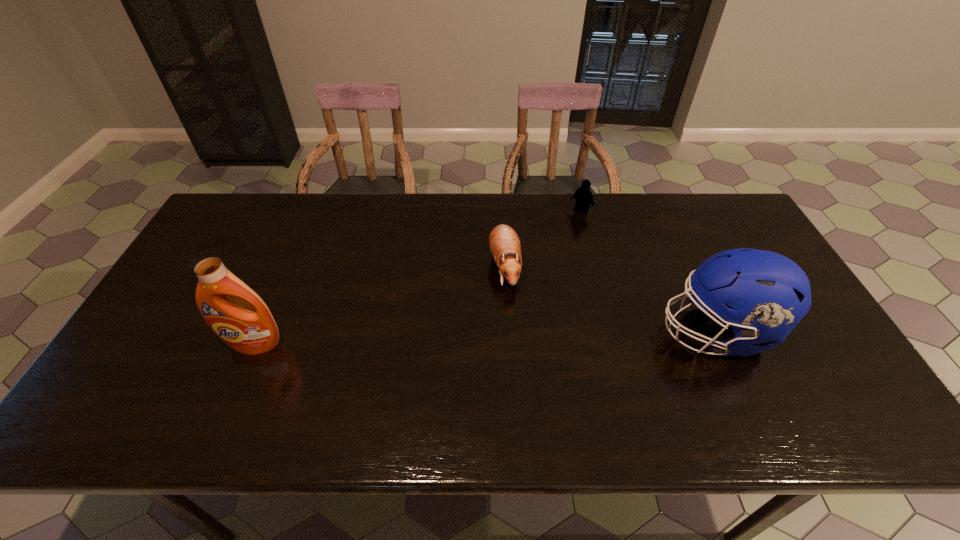
What are the coordinates of `the leftmost object` in the screenshot? It's located at (235, 313).

In order to click on the third shortest object in this screenshot , I will do (768, 293).

Where is `football helmet`? Image resolution: width=960 pixels, height=540 pixels. football helmet is located at coordinates (768, 293).

In order to click on Lego in this screenshot , I will do `click(583, 195)`.

This screenshot has width=960, height=540. What are the coordinates of `the farthest object` in the screenshot? It's located at (583, 195).

Where is `the third object from right to left`? the third object from right to left is located at coordinates (504, 243).

The image size is (960, 540). In order to click on hamster in this screenshot , I will do `click(504, 243)`.

Where is `vacant area located 0.090m on the front-facing side of the detergent`? This screenshot has width=960, height=540. vacant area located 0.090m on the front-facing side of the detergent is located at coordinates (236, 387).

I want to click on blank space located 0.130m on the front-facing side of the third shortest object, so click(609, 332).

The height and width of the screenshot is (540, 960). I want to click on free space located 0.310m on the front-facing side of the third shortest object, so click(x=540, y=332).